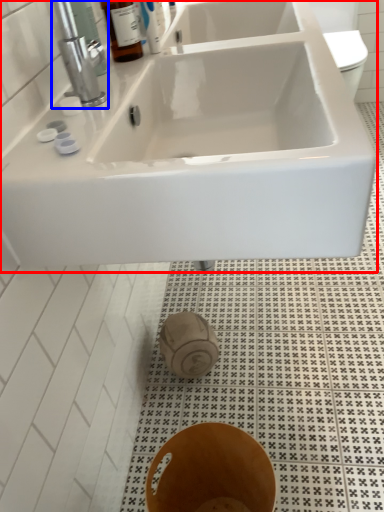
Question: Among these objects, which one is nearest to the camera, sink (highlighted by a red box) or tap (highlighted by a blue box)?

Choices:
 (A) sink
 (B) tap

Answer: (A)